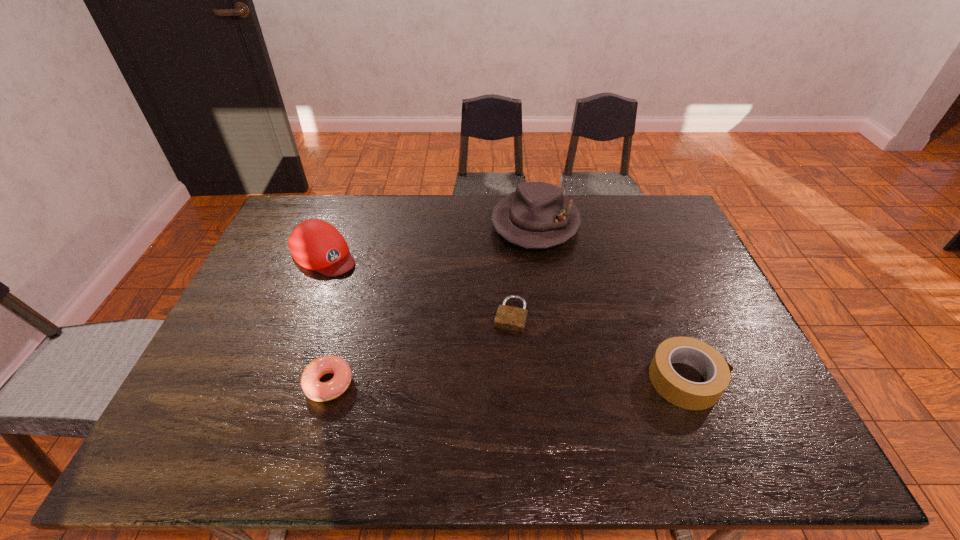
You are a GUI agent. You are given a task and a screenshot of the screen. Output one action in this format:
    pyautogui.click(x=<x>, y=<y>)
    Task: Click on the fourth tallest object
    
    Given the screenshot: What is the action you would take?
    pyautogui.click(x=318, y=391)

Locate an element on the screen. The image size is (960, 540). the third shortest object is located at coordinates (715, 370).

Where is `the rightmost object`? The height and width of the screenshot is (540, 960). the rightmost object is located at coordinates (715, 370).

Where is `the third nearest object`? Image resolution: width=960 pixels, height=540 pixels. the third nearest object is located at coordinates (511, 318).

This screenshot has height=540, width=960. I want to click on the shortest object, so click(511, 318).

Image resolution: width=960 pixels, height=540 pixels. What are the coordinates of `hat` in the screenshot? It's located at (537, 215).

Locate an element on the screen. The width and height of the screenshot is (960, 540). the fourth shortest object is located at coordinates coord(315,244).

I want to click on free space located 0.120m on the right of the doughnut, so click(x=402, y=383).

Locate an element on the screen. Image resolution: width=960 pixels, height=540 pixels. vacant region located on the keyhole side of the shortest object is located at coordinates (500, 359).

You are a GUI agent. You are given a task and a screenshot of the screen. Output one action in this format:
    pyautogui.click(x=<x>, y=<y>)
    Task: Click on the vacant space located on the keyhole side of the shortest object
    
    Given the screenshot: What is the action you would take?
    pyautogui.click(x=489, y=399)